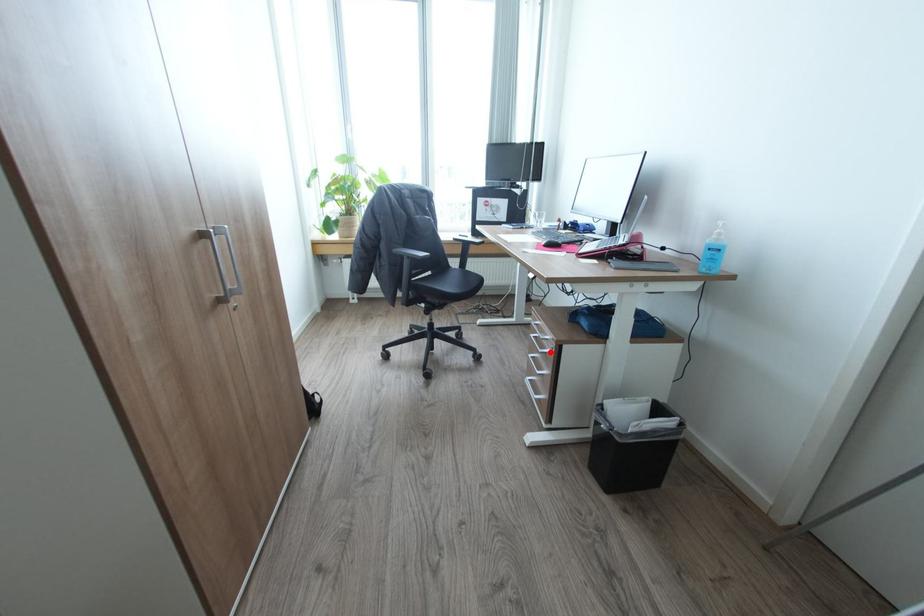
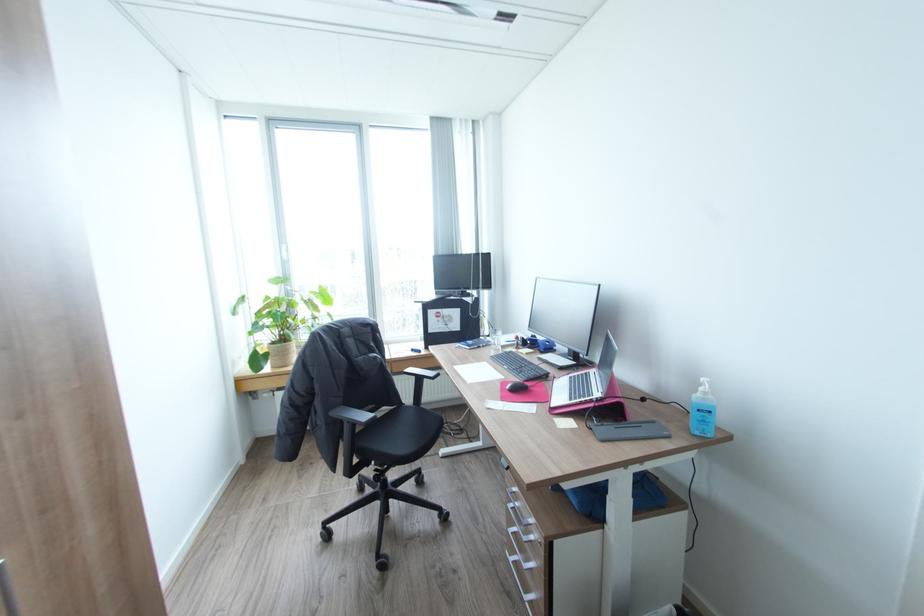
Question: I am providing you with two images of the same scene from different viewpoints. A red point is marked on the first image. Can you still see the location of the red point in image 2?

Choices:
 (A) Yes
 (B) No

Answer: (A)